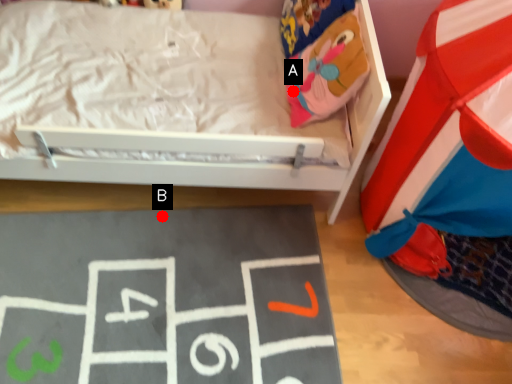
Question: Two points are circled on the image, labeled by A and B beside each circle. Which of the following is the closest to the observer?

Choices:
 (A) A is closer
 (B) B is closer

Answer: (A)